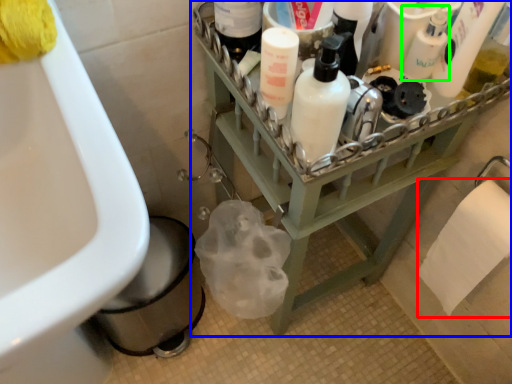
Question: Which object is the farthest from toilet paper (highlighted by a red box)? Choose among these: furniture (highlighted by a blue box) or cleaning product (highlighted by a green box).

Choices:
 (A) furniture
 (B) cleaning product

Answer: (B)